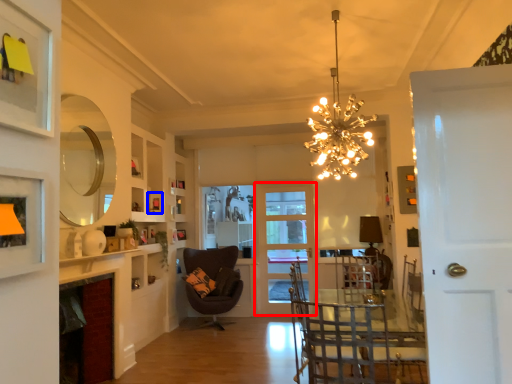
Question: Which object appears farthest to the camera in this image, door (highlighted by a red box) or picture frame (highlighted by a blue box)?

Choices:
 (A) door
 (B) picture frame

Answer: (A)